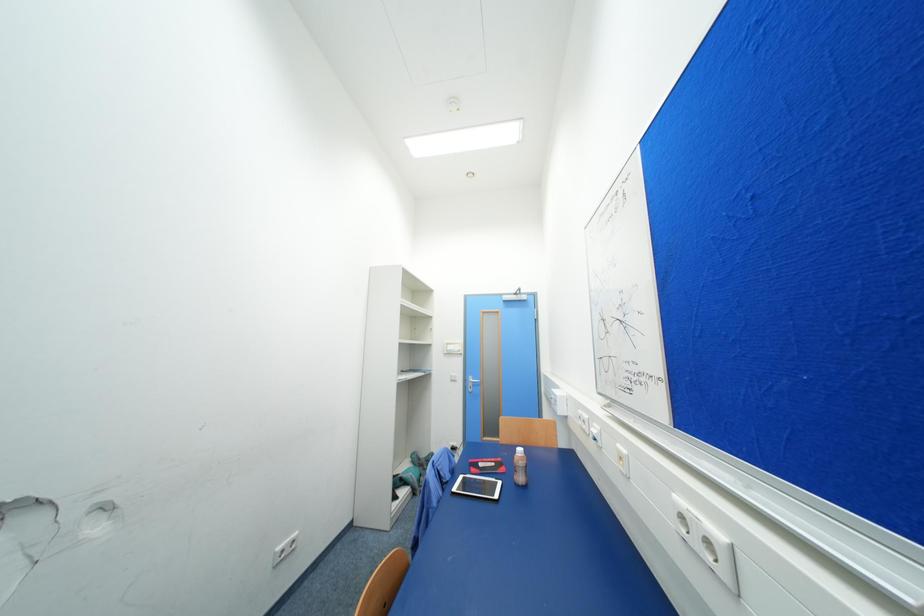
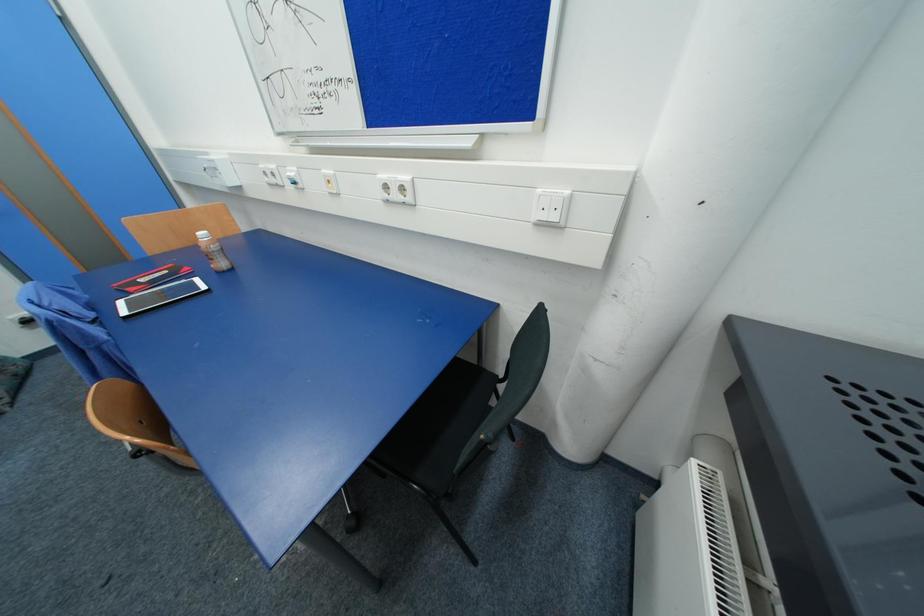
First-person continuous shooting, in which direction is the camera rotating?

The rotation direction of the camera is right-down.